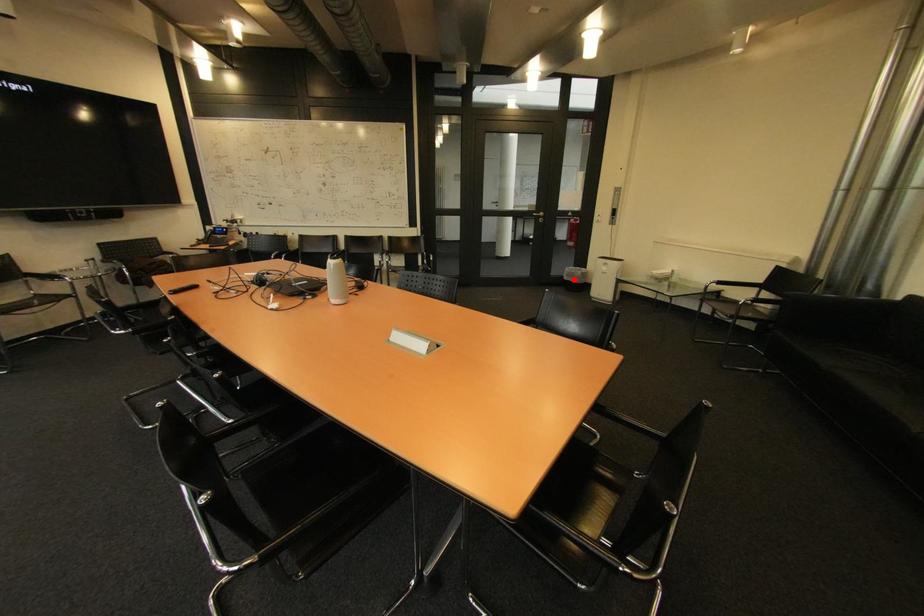
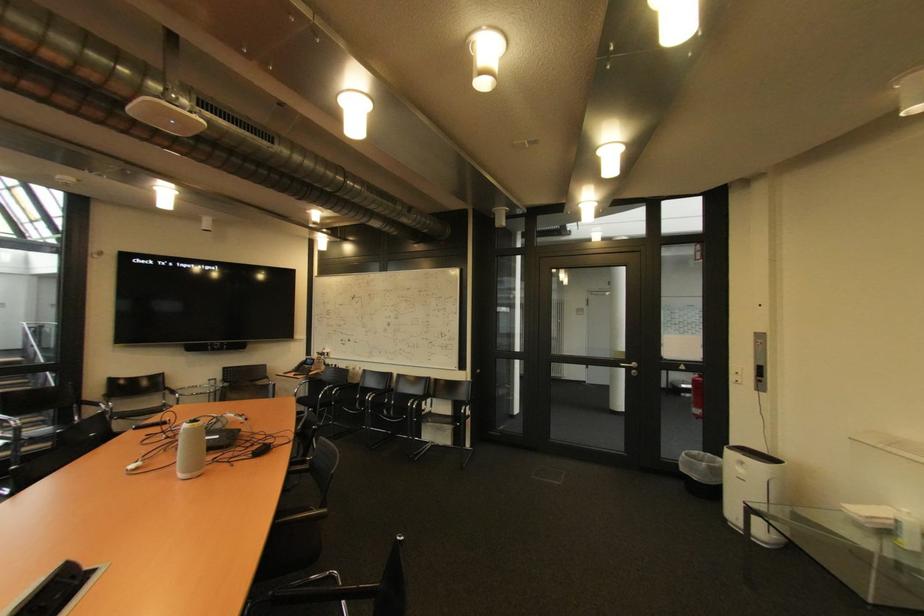
Question: A red point is marked in image1. In image2, is the corresponding 3D point closer to the camera or farther? Reply with the corresponding letter.

Choices:
 (A) The corresponding 3D point is closer.
 (B) The corresponding 3D point is farther.

Answer: (B)